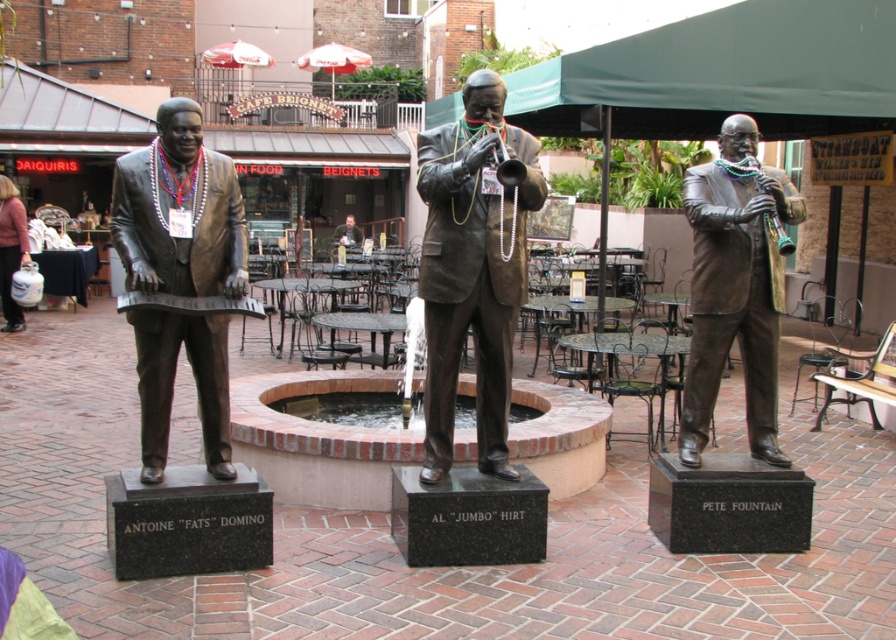
Question: Which object is positioned closest to the bronze statue of man playing clarinet at center?

Choices:
 (A) bronze statue at center
 (B) brushed metal water at bottle left
 (C) green fabric canopy at upper center
 (D) bronze statue at left

Answer: (A)

Question: Is green fabric canopy at upper center below bronze statue of man playing clarinet at center?

Choices:
 (A) yes
 (B) no

Answer: (B)

Question: Which point appears closest to the camera in this image?

Choices:
 (A) (16, 224)
 (B) (168, 145)
 (C) (478, 74)

Answer: (B)

Question: Does green fabric canopy at upper center have a lesser width compared to brushed metal water at bottle left?

Choices:
 (A) yes
 (B) no

Answer: (A)

Question: Among these objects, which one is nearest to the camera?

Choices:
 (A) green fabric canopy at upper center
 (B) bronze statue of man playing clarinet at center
 (C) bronze statue at left

Answer: (C)

Question: Can you confirm if bronze statue at left is positioned to the left of bronze statue of man playing clarinet at center?

Choices:
 (A) yes
 (B) no

Answer: (A)